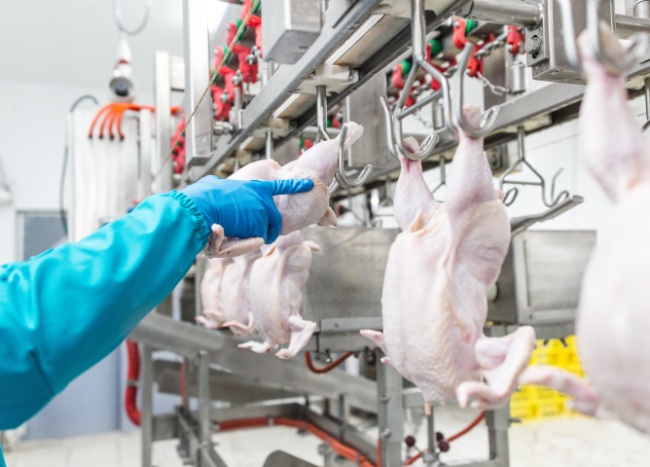
You are a GUI agent. You are given a task and a screenshot of the screen. Output one action in this format:
    pyautogui.click(x=<x>, y=<y>)
    Task: Click on the hook
    Image resolution: width=650 pixels, height=467 pixels.
    Given the screenshot: What is the action you would take?
    pyautogui.click(x=420, y=153)